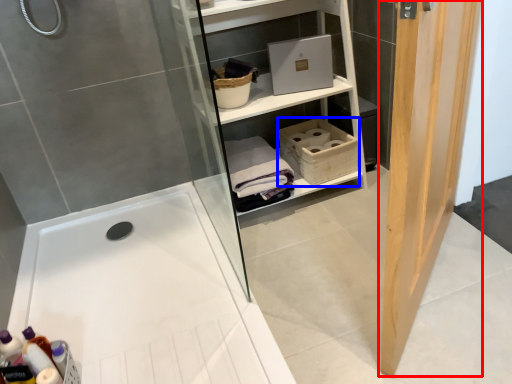
Question: Which of the following is the closest to the observer, door (highlighted by a red box) or basket (highlighted by a blue box)?

Choices:
 (A) door
 (B) basket

Answer: (A)